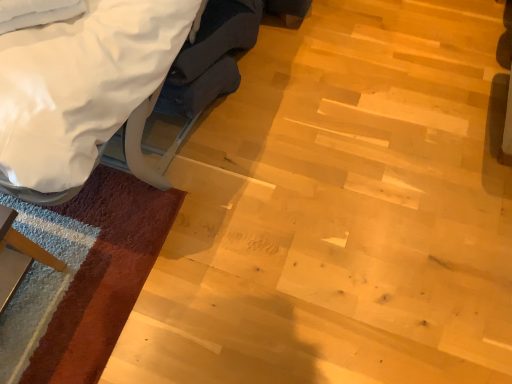
Identify the location of vacant area that lies to the right of white fabric swivel chair at upper left. This screenshot has width=512, height=384. (318, 73).